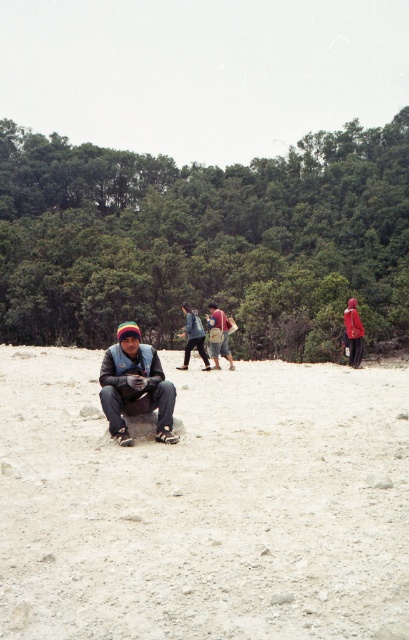
You are standing at the origin point of the coordinate system and want to reach the light brown sandy ground at center. What are the coordinates you need to move to?

The coordinates to reach the light brown sandy ground at center are point (204, 504).